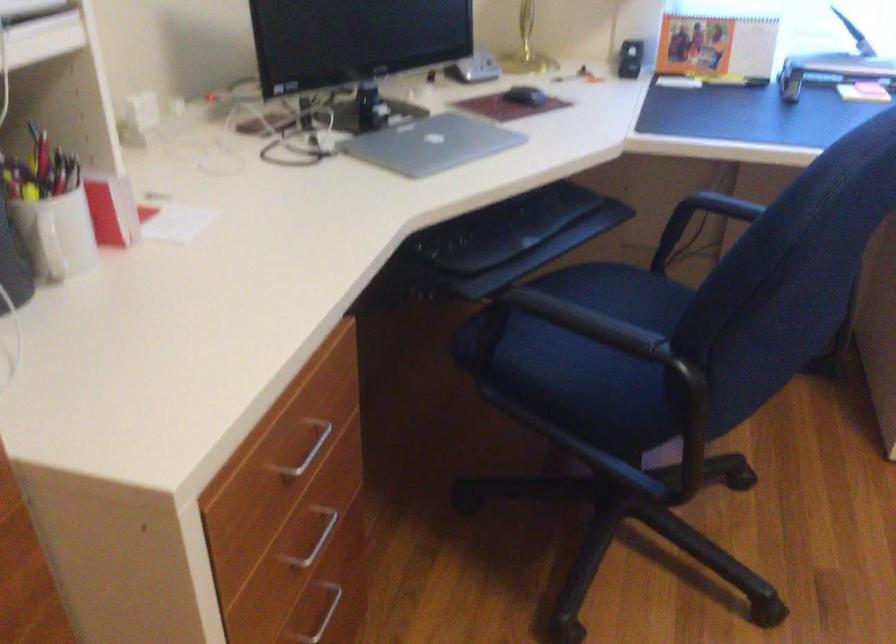
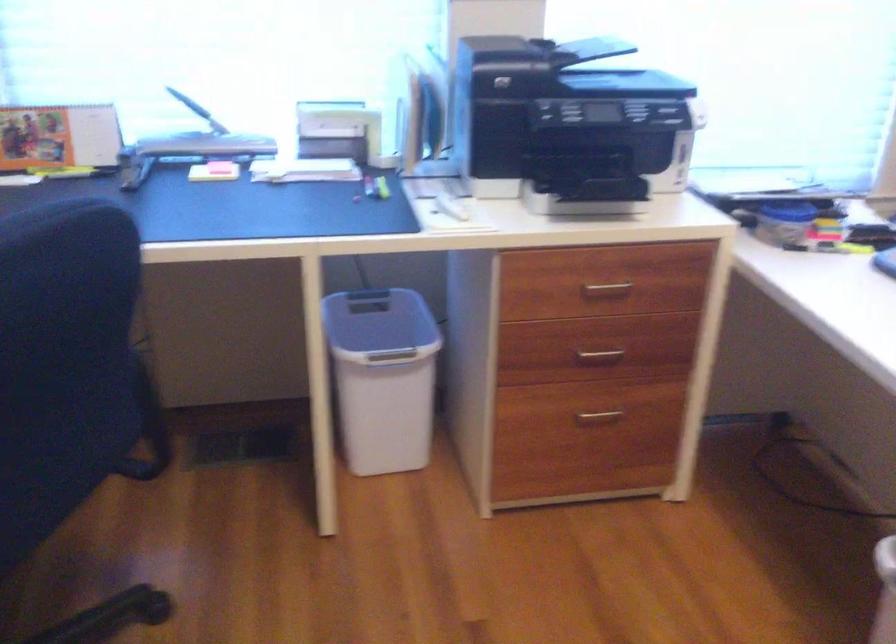
Question: The images are taken continuously from a first-person perspective. In which direction are you moving?

Choices:
 (A) Left
 (B) Right
 (C) Forward
 (D) Backward

Answer: (B)